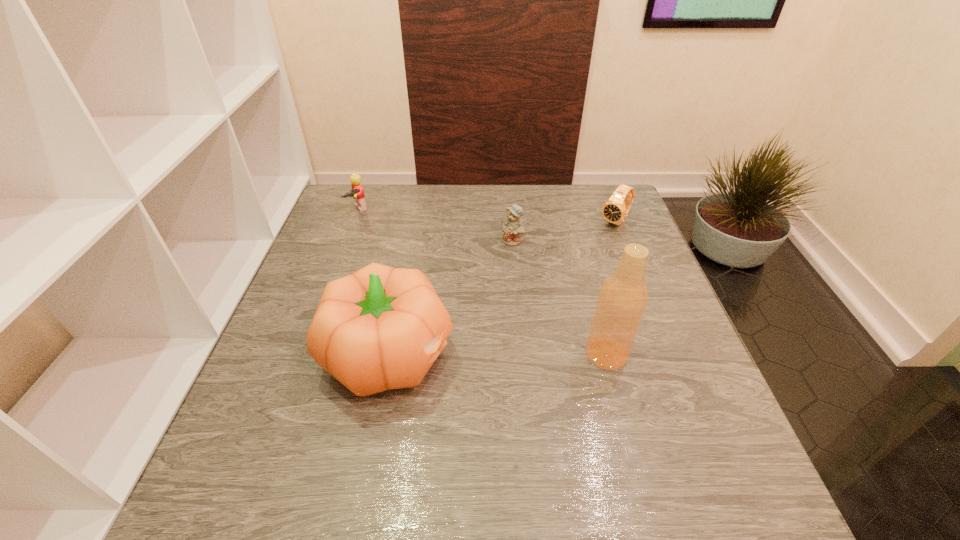
Where is `the second tallest object`? the second tallest object is located at coordinates (380, 328).

I want to click on pumpkin, so click(380, 328).

I want to click on the tallest object, so click(x=622, y=299).

At what (x,y) coordinates should I click in order to perform the action: click on the second object from right to left. Please return your answer as a coordinate pair (x, y). Looking at the image, I should click on (622, 299).

The image size is (960, 540). Identify the location of the third object from left to right. (512, 228).

What are the coordinates of `the third farthest object` in the screenshot? It's located at coord(512,228).

The height and width of the screenshot is (540, 960). What are the coordinates of `Lego` in the screenshot? It's located at (357, 193).

This screenshot has height=540, width=960. Find the location of `watch`. watch is located at coordinates (615, 209).

I want to click on vacant position located on the carved face of the fourth shortest object, so click(512, 354).

The image size is (960, 540). I want to click on blank area located on the left of the fourth object from left to right, so click(x=448, y=354).